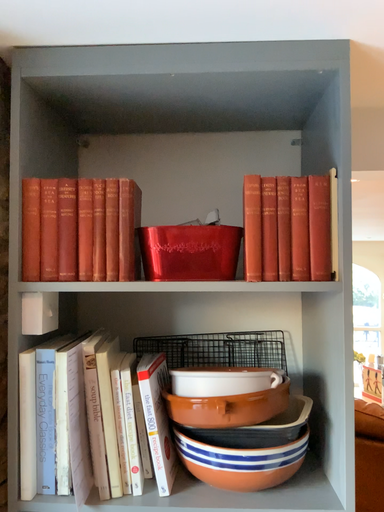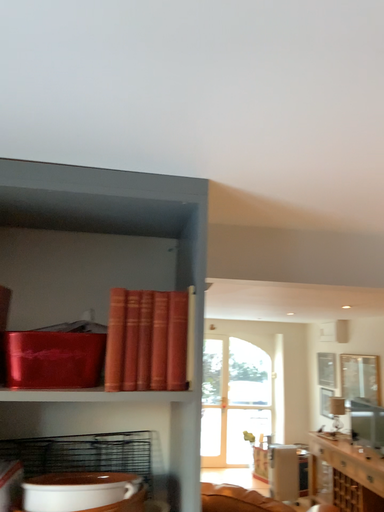
Question: How did the camera likely rotate when shooting the video?

Choices:
 (A) rotated right
 (B) rotated left

Answer: (A)